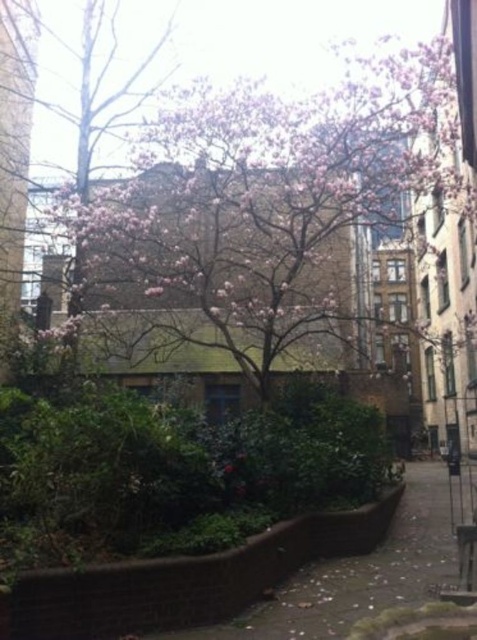
You are standing on the brown concrete pavement at lower center and want to take a photo of the pink bloom tree at center. In which direction should you move to frame the tree properly in your camera?

Since the pink bloom tree at center is to the right of the brown concrete pavement at lower center, you should move to the right to position yourself so the tree is centered in your camera frame.

Consider the image. You are standing in the urban garden scene and want to take a photo of the pink bloom tree at center. To ensure the tree is centered in your shot, where should you position your camera relative to the scene?

To center the pink bloom tree at center in your photo, position your camera so that the tree is aligned with the point at coordinates 0.330 on the x axis and 0.556 on the y axis.